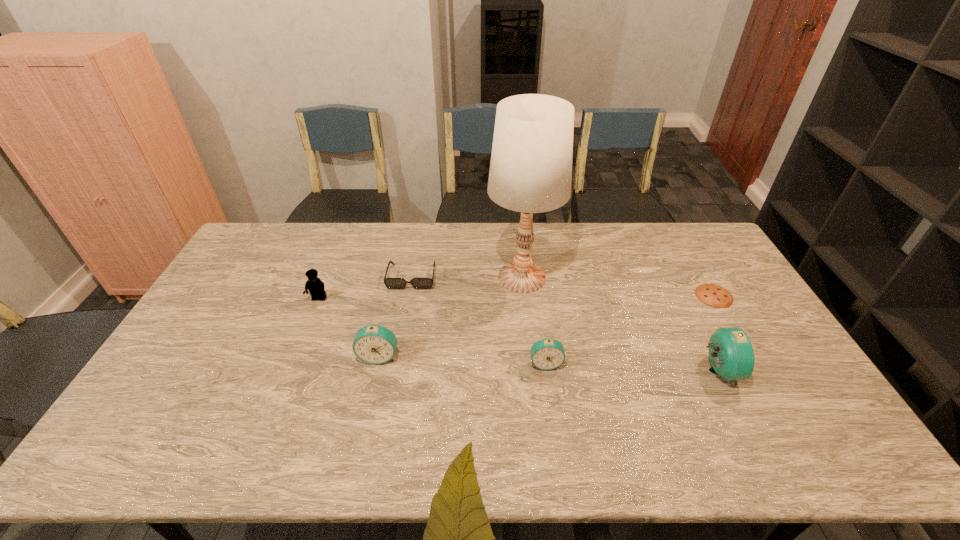
Identify the location of free space located on the front-facing side of the second tallest alarm clock. (365, 421).

I want to click on vacant space positioned on the front-facing side of the fifth tallest object, so click(x=551, y=403).

Locate an element on the screen. This screenshot has height=540, width=960. free space located on the front-facing side of the sixth shortest object is located at coordinates (755, 371).

The height and width of the screenshot is (540, 960). What are the coordinates of `vacant space located 0.290m on the front-facing side of the sunglasses` in the screenshot? It's located at (396, 362).

Identify the location of free space located on the left of the tallest object. This screenshot has width=960, height=540. (384, 278).

The height and width of the screenshot is (540, 960). In order to click on vacant space located on the front-facing side of the Lego in this screenshot , I will do `click(286, 382)`.

The width and height of the screenshot is (960, 540). I want to click on free space located 0.270m on the front of the rightmost object, so click(x=762, y=379).

Locate an element on the screen. The width and height of the screenshot is (960, 540). object that is at the far edge is located at coordinates (530, 172).

The image size is (960, 540). In order to click on object that is at the near edge in this screenshot , I will do `click(731, 354)`.

Find the location of a particular element. The image size is (960, 540). object that is at the right edge is located at coordinates (713, 295).